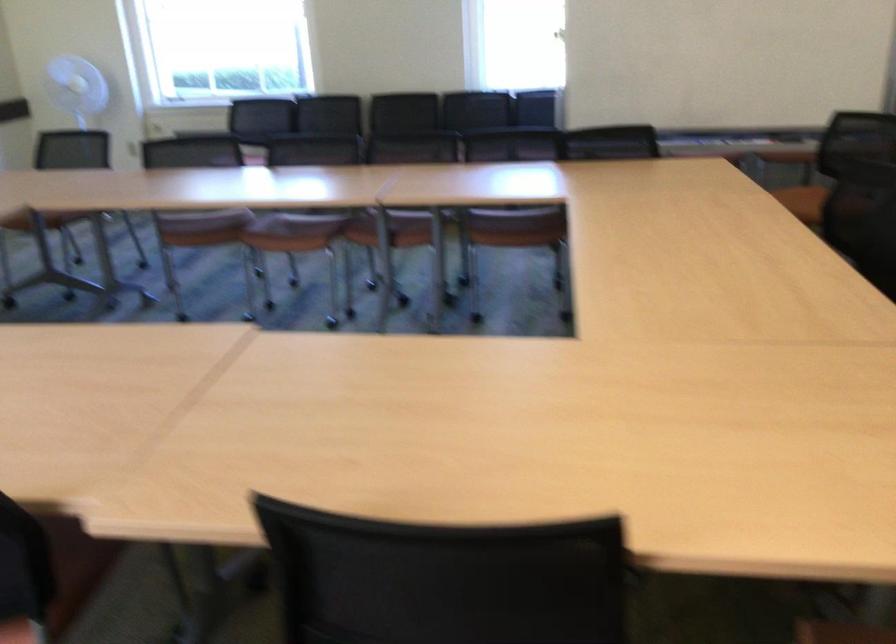
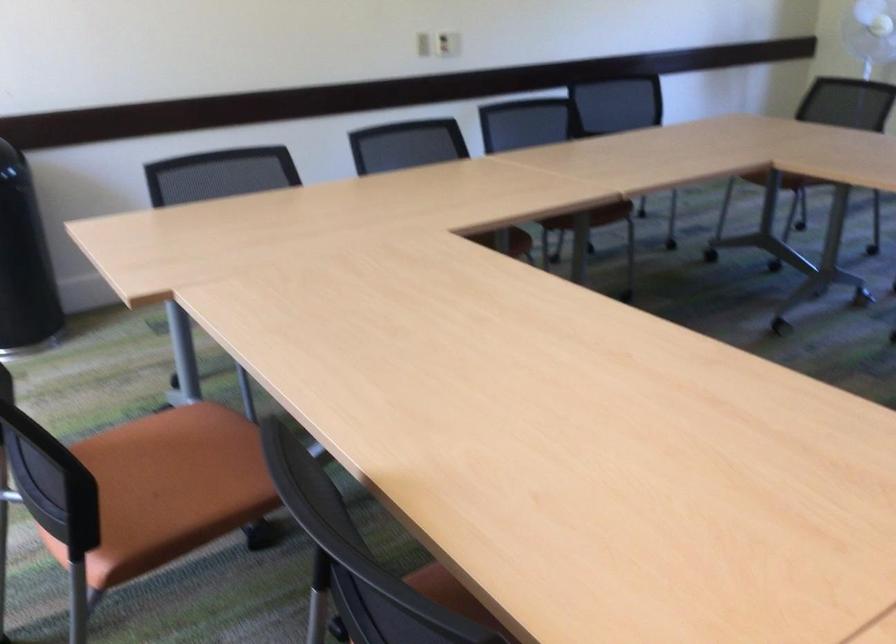
Question: How did the camera likely rotate?

Choices:
 (A) Left
 (B) Right
 (C) Up
 (D) Down

Answer: (A)